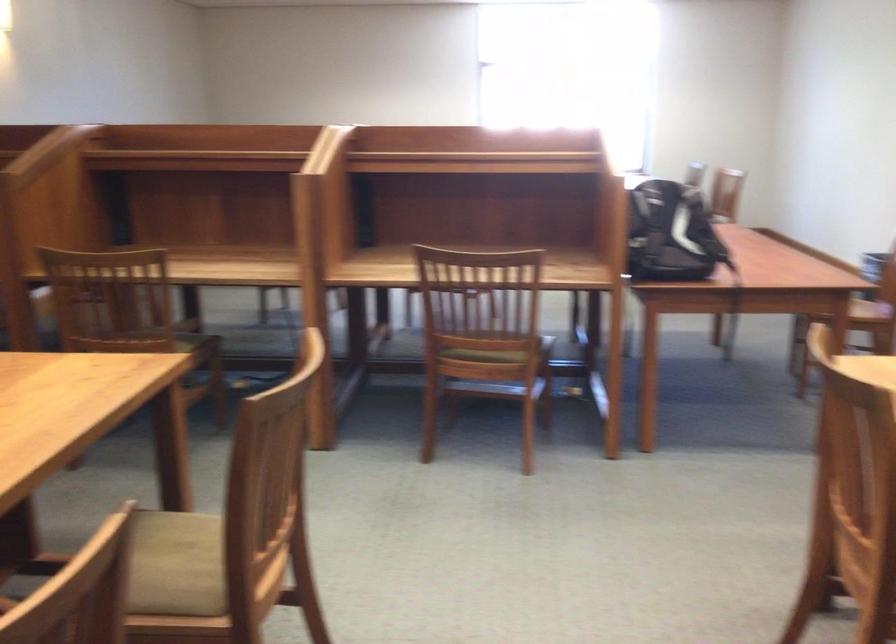
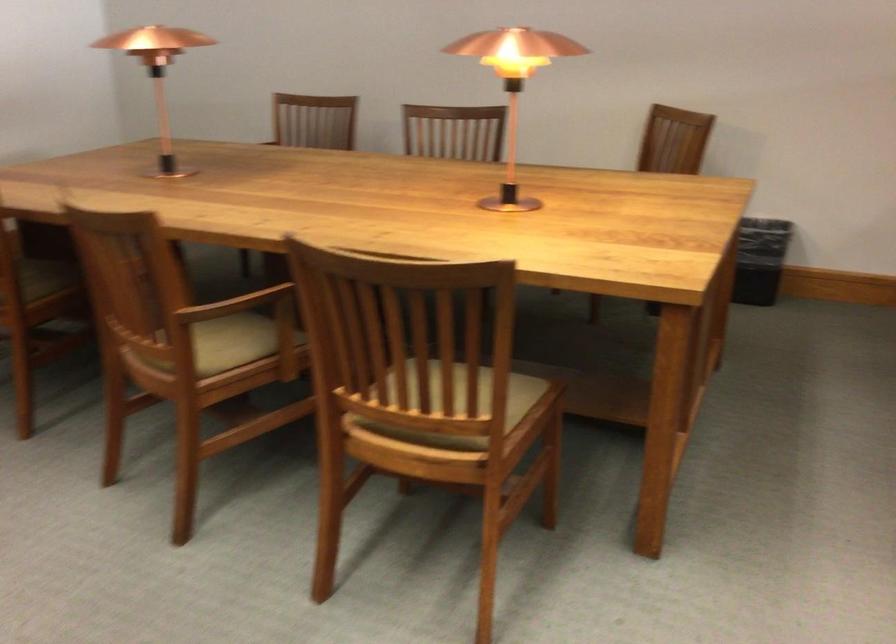
Find the pixel in the second image that matches point (289, 489) in the first image.

(460, 404)